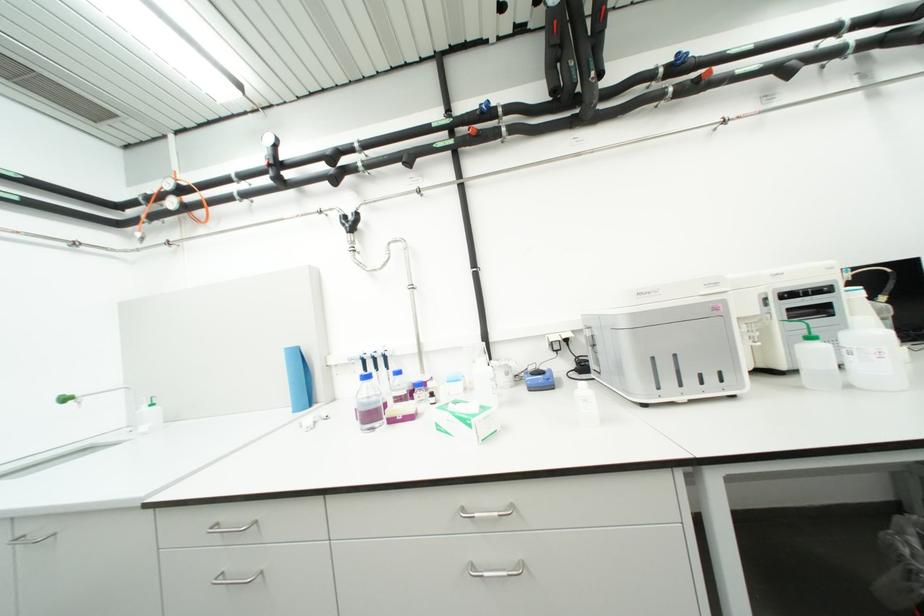
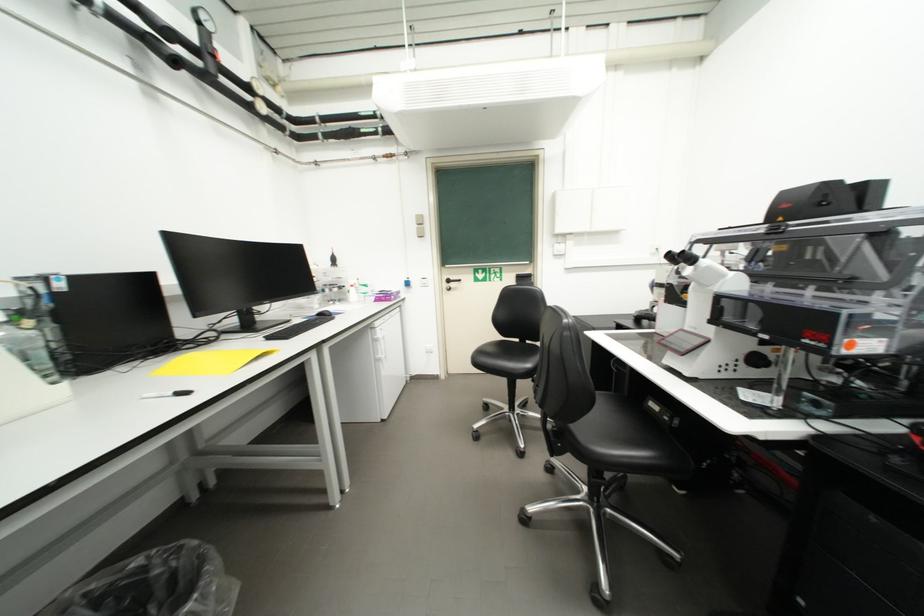
Question: The camera is either moving clockwise (left) or counter-clockwise (right) around the object. The first image is from the beginning of the video and the second image is from the end. Is the camera moving left or right when shooting the video?

Choices:
 (A) Left
 (B) Right

Answer: (A)